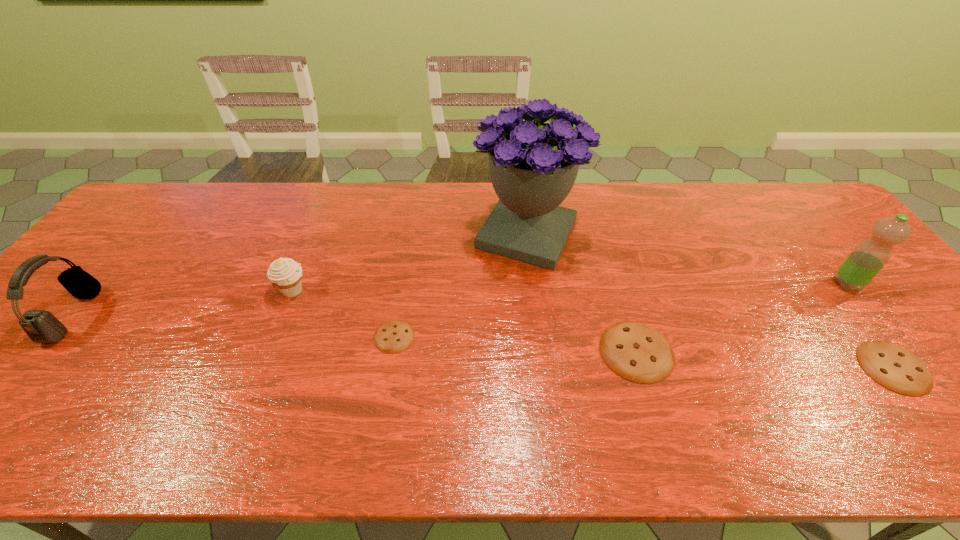
Identify the location of free point between the second cookie from right to left and the fifth object from right to left. (516, 344).

Identify the location of free space between the fifth object from right to left and the farthest object. The height and width of the screenshot is (540, 960). (461, 285).

Identify the location of vacant region between the fourth shortest object and the sixth shortest object. The width and height of the screenshot is (960, 540). (569, 287).

The height and width of the screenshot is (540, 960). Identify the location of vacant point located between the muffin and the shortest object. (344, 313).

Where is `free point between the leftmost object and the sixth tallest object`? free point between the leftmost object and the sixth tallest object is located at coordinates (484, 341).

Find the location of a particular element. The width and height of the screenshot is (960, 540). empty location between the rightmost cookie and the tallest object is located at coordinates (710, 301).

Find the location of a particular element. The image size is (960, 540). free point between the shortest cookie and the fourth shortest object is located at coordinates (344, 313).

At what (x,y) coordinates should I click in order to perform the action: click on vacant area that lies between the muffin and the second cookie from right to left. Please return your answer as a coordinate pair (x, y). Looking at the image, I should click on (465, 321).

At what (x,y) coordinates should I click in order to perform the action: click on free space between the second cookie from left to right and the muffin. Please return your answer as a coordinate pair (x, y). Looking at the image, I should click on (465, 321).

Image resolution: width=960 pixels, height=540 pixels. In order to click on vacant space that is in between the second cookie from left to right and the leftmost object in this screenshot , I will do `click(355, 333)`.